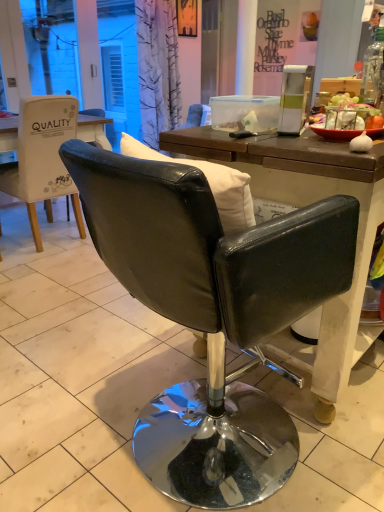
Question: From a real-world perspective, is black leather chair at center, arranged as the 1th chair when viewed from the right, located higher than transparent glass bottle at upper right?

Choices:
 (A) no
 (B) yes

Answer: (A)

Question: Considering the relative sizes of black leather chair at center, marked as the second chair in a left-to-right arrangement, and transparent glass bottle at upper right in the image provided, is black leather chair at center, marked as the second chair in a left-to-right arrangement, thinner than transparent glass bottle at upper right?

Choices:
 (A) no
 (B) yes

Answer: (A)

Question: Can you confirm if black leather chair at center, which is the 1th chair from front to back, is taller than transparent glass bottle at upper right?

Choices:
 (A) yes
 (B) no

Answer: (A)

Question: From the image's perspective, is black leather chair at center, marked as the second chair in a left-to-right arrangement, located above transparent glass bottle at upper right?

Choices:
 (A) yes
 (B) no

Answer: (B)

Question: Is white leather chair at left, acting as the first chair starting from the back, inside or outside of matte black sign at upper center?

Choices:
 (A) inside
 (B) outside

Answer: (B)

Question: From a real-world perspective, is white leather chair at left, which is the 2th chair from right to left, physically located above or below matte black sign at upper center?

Choices:
 (A) above
 (B) below

Answer: (B)

Question: Is point (31, 172) positioned closer to the camera than point (264, 20)?

Choices:
 (A) farther
 (B) closer

Answer: (B)

Question: Considering the relative positions of white leather chair at left, the first chair from the left, and matte black sign at upper center in the image provided, is white leather chair at left, the first chair from the left, to the left or to the right of matte black sign at upper center?

Choices:
 (A) left
 (B) right

Answer: (A)

Question: Considering their positions, is transparent glass bottle at upper right located in front of or behind white leather chair at left, the first chair from the left?

Choices:
 (A) behind
 (B) front

Answer: (B)

Question: From a real-world perspective, is transparent glass bottle at upper right positioned above or below white leather chair at left, acting as the first chair starting from the back?

Choices:
 (A) above
 (B) below

Answer: (A)

Question: From the image's perspective, is transparent glass bottle at upper right located above or below white leather chair at left, which is the 2th chair from right to left?

Choices:
 (A) above
 (B) below

Answer: (A)

Question: Looking at the image, does transparent glass bottle at upper right seem bigger or smaller compared to white leather chair at left, the 2th chair from the front?

Choices:
 (A) big
 (B) small

Answer: (B)

Question: Looking at their shapes, would you say matte black sign at upper center is wider or thinner than transparent glass bottle at upper right?

Choices:
 (A) wide
 (B) thin

Answer: (B)

Question: Choose the correct answer: Is matte black sign at upper center inside transparent glass bottle at upper right or outside it?

Choices:
 (A) inside
 (B) outside

Answer: (B)